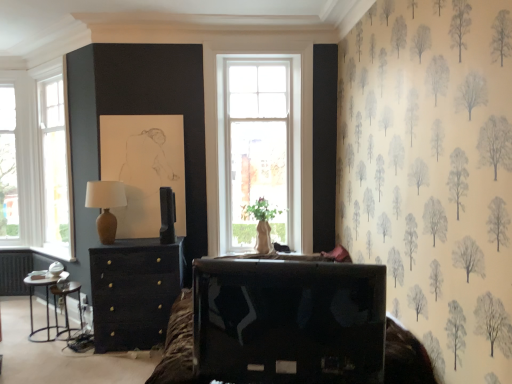
The width and height of the screenshot is (512, 384). Describe the element at coordinates (37, 163) in the screenshot. I see `white glass window at left` at that location.

Locate an element on the screen. The width and height of the screenshot is (512, 384). metallic black side table at lower left is located at coordinates (46, 300).

Locate an element on the screen. Image resolution: width=512 pixels, height=384 pixels. metallic silver side table at lower left is located at coordinates (66, 307).

In order to face metallic silver side table at lower left, should I rotate leftwards or rightwards?

It's best to rotate left around 23.532 degrees.

Describe the element at coordinates (288, 320) in the screenshot. I see `shiny black tv at lower center` at that location.

Measure the distance between point [110,199] and camera.

They are 3.76 meters apart.

Where is `white glass window at left`? This screenshot has height=384, width=512. white glass window at left is located at coordinates (37, 163).

Can we say matte black chest of drawers at center lies outside metallic silver side table at lower left?

Indeed, matte black chest of drawers at center is completely outside metallic silver side table at lower left.

Is matte black chest of drawers at center positioned with its back to metallic silver side table at lower left?

No, matte black chest of drawers at center's orientation is not away from metallic silver side table at lower left.

Does matte black chest of drawers at center have a smaller size compared to metallic silver side table at lower left?

No, matte black chest of drawers at center is not smaller than metallic silver side table at lower left.

Is matte black chest of drawers at center next to metallic silver side table at lower left?

matte black chest of drawers at center is not next to metallic silver side table at lower left, and they're not touching.

In the image, is shiny black tv at lower center positioned in front of or behind white glass window at left?

shiny black tv at lower center is in front of white glass window at left.

Can you confirm if shiny black tv at lower center is shorter than white glass window at left?

Correct, shiny black tv at lower center is not as tall as white glass window at left.

Is shiny black tv at lower center thinner than white glass window at left?

Indeed, shiny black tv at lower center has a lesser width compared to white glass window at left.

Considering the sizes of objects shiny black tv at lower center and matte black chest of drawers at center in the image provided, who is bigger, shiny black tv at lower center or matte black chest of drawers at center?

matte black chest of drawers at center is bigger.

Is point (234, 374) closer or farther from the camera than point (126, 298)?

Clearly, point (234, 374) is closer to the camera than point (126, 298).

Does shiny black tv at lower center appear on the left side of matte black chest of drawers at center?

No, shiny black tv at lower center is not to the left of matte black chest of drawers at center.

Is matte black chest of drawers at center a part of shiny black tv at lower center?

No, matte black chest of drawers at center is not inside shiny black tv at lower center.

How far apart are metallic silver side table at lower left and shiny black tv at lower center?

They are 2.77 meters apart.

From a real-world perspective, which object stands above the other?

shiny black tv at lower center.

Do you think metallic silver side table at lower left is within shiny black tv at lower center, or outside of it?

metallic silver side table at lower left exists outside the volume of shiny black tv at lower center.

Does point (77, 335) come behind point (284, 324)?

Yes.

Does white glass window at left have a lesser width compared to metallic silver side table at lower left?

Indeed, white glass window at left has a lesser width compared to metallic silver side table at lower left.

Is point (21, 110) positioned in front of point (60, 287)?

No, it is not.

From a real-world perspective, is white glass window at left positioned above or below metallic silver side table at lower left?

Clearly, from a real-world perspective, white glass window at left is above metallic silver side table at lower left.

Is white glass window at left smaller than metallic silver side table at lower left?

Incorrect, white glass window at left is not smaller in size than metallic silver side table at lower left.

Considering the relative sizes of metallic black side table at lower left and metallic silver side table at lower left in the image provided, is metallic black side table at lower left smaller than metallic silver side table at lower left?

No.

Considering the sizes of objects metallic black side table at lower left and metallic silver side table at lower left in the image provided, who is thinner, metallic black side table at lower left or metallic silver side table at lower left?

With smaller width is metallic silver side table at lower left.

Can you tell me how much metallic black side table at lower left and metallic silver side table at lower left differ in facing direction?

The angle between the facing direction of metallic black side table at lower left and the facing direction of metallic silver side table at lower left is 2.07e-05 degrees.

Looking at this image, from a real-world perspective, is metallic black side table at lower left under metallic silver side table at lower left?

Actually, metallic black side table at lower left is physically above metallic silver side table at lower left in the real world.

Considering the sizes of objects matte brown table lamp at left and metallic black side table at lower left in the image provided, who is shorter, matte brown table lamp at left or metallic black side table at lower left?

matte brown table lamp at left is shorter.

Between matte brown table lamp at left and metallic black side table at lower left, which one appears on the left side from the viewer's perspective?

Positioned to the left is metallic black side table at lower left.

Which of these two, matte brown table lamp at left or metallic black side table at lower left, is wider?

Wider between the two is metallic black side table at lower left.

Find the location of `side table below the matte black chest of drawers at center (from a real-world perspective)`. side table below the matte black chest of drawers at center (from a real-world perspective) is located at coordinates (66, 307).

Where is `furniture located in front of the white glass window at left`? The width and height of the screenshot is (512, 384). furniture located in front of the white glass window at left is located at coordinates (288, 320).

Considering their positions, is white glass window at left positioned further to metallic silver side table at lower left than shiny black tv at lower center?

shiny black tv at lower center is positioned further to the anchor metallic silver side table at lower left.

Estimate the real-world distances between objects in this image. Which object is further from shiny black tv at lower center, metallic black side table at lower left or metallic silver side table at lower left?

Based on the image, metallic black side table at lower left appears to be further to shiny black tv at lower center.

Which object lies nearer to the anchor point matte brown table lamp at left, matte black chest of drawers at center or metallic silver side table at lower left?

matte black chest of drawers at center lies closer to matte brown table lamp at left than the other object.

Considering their positions, is matte brown table lamp at left positioned closer to metallic black side table at lower left than white glass window at left?

matte brown table lamp at left is positioned closer to the anchor metallic black side table at lower left.

When comparing their distances from matte brown table lamp at left, does metallic black side table at lower left or metallic silver side table at lower left seem further?

metallic black side table at lower left is further to matte brown table lamp at left.

From the image, which object appears to be farther from matte black chest of drawers at center, white glass window at left or shiny black tv at lower center?

Based on the image, white glass window at left appears to be further to matte black chest of drawers at center.

Based on the photo, when comparing their distances from white glass window at left, does metallic silver side table at lower left or metallic black side table at lower left seem further?

The object further to white glass window at left is metallic silver side table at lower left.

When comparing their distances from matte brown table lamp at left, does shiny black tv at lower center or metallic silver side table at lower left seem closer?

metallic silver side table at lower left.

This screenshot has width=512, height=384. Find the location of `chest of drawers between shiny black tv at lower center and white glass window at left from front to back`. chest of drawers between shiny black tv at lower center and white glass window at left from front to back is located at coordinates (134, 292).

Identify the location of chest of drawers between shiny black tv at lower center and metallic black side table at lower left along the z-axis. This screenshot has width=512, height=384. (134, 292).

The image size is (512, 384). I want to click on table between shiny black tv at lower center and white glass window at left from front to back, so tap(46, 300).

The width and height of the screenshot is (512, 384). In order to click on side table between white glass window at left and matte black chest of drawers at center in this screenshot , I will do `click(66, 307)`.